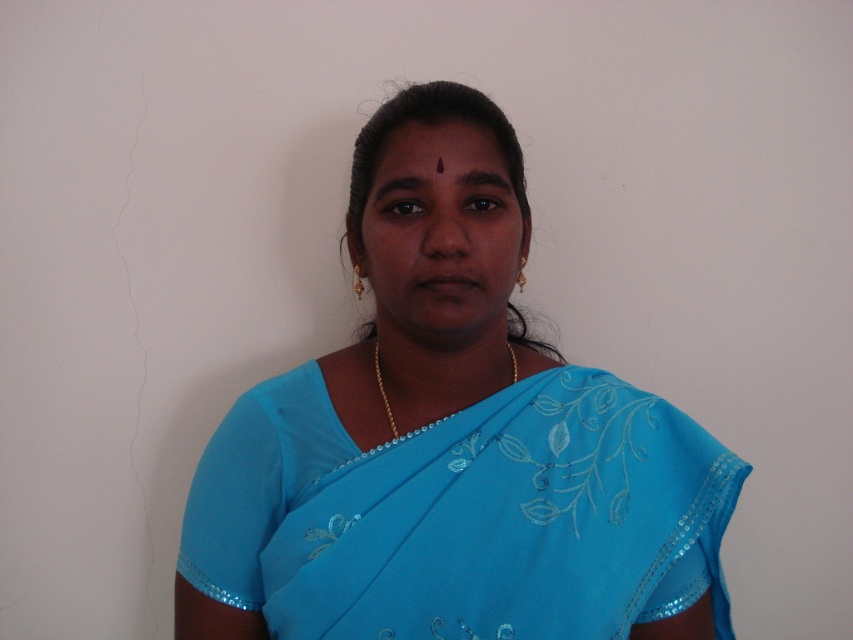
You are a fashion designer who wants to create a matching accessory for the blue silk saree at center and the gold chain at center. Which object should you consider the size of when designing the accessory to ensure it complements both?

The blue silk saree at center has a larger width than the gold chain at center, so designing the accessory based on the size of the blue silk saree at center would ensure it complements both objects appropriately.